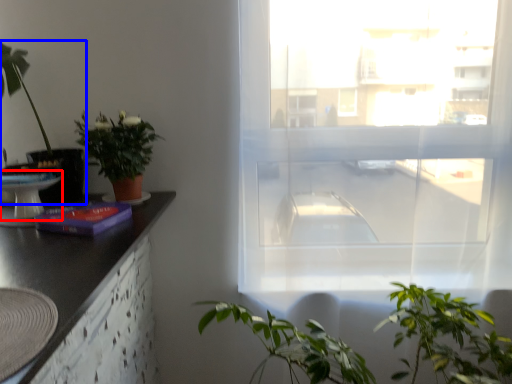
Question: Which point is closer to the camera, round table (highlighted by a red box) or houseplant (highlighted by a blue box)?

Choices:
 (A) round table
 (B) houseplant

Answer: (A)